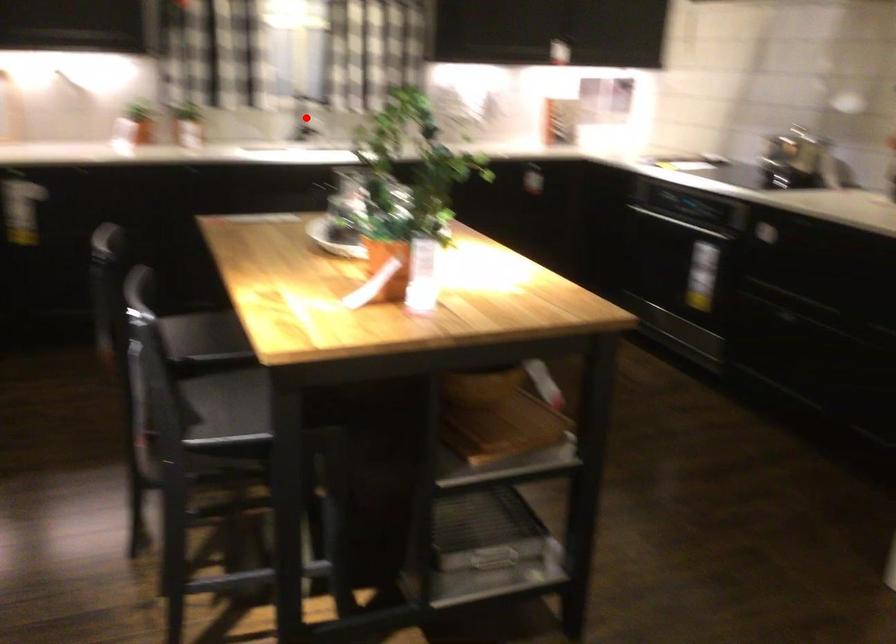
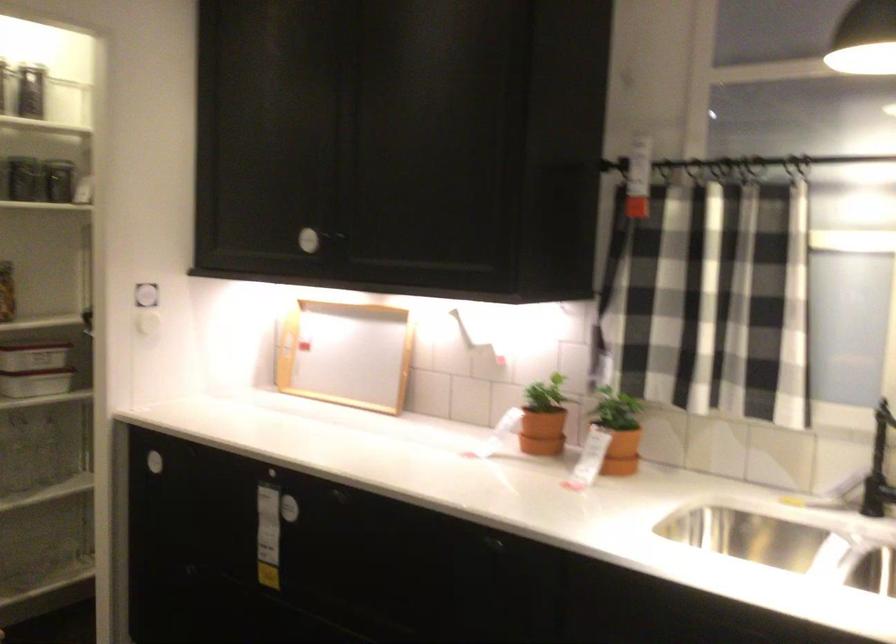
Find the pixel in the second image that matches the highlighted location in the first image.

(879, 468)